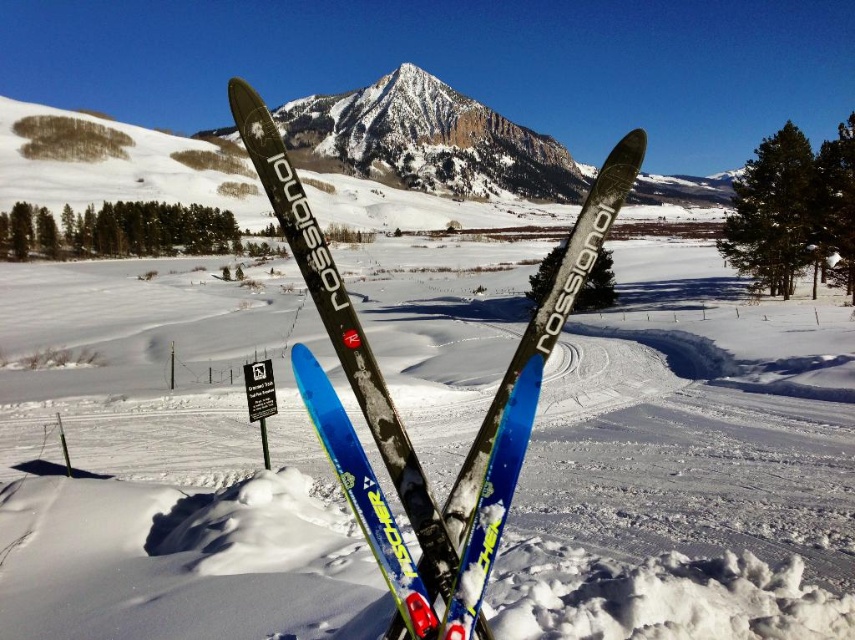
Consider the image. Measure the distance between blue glossy fischer skis at center and snowy granite peak at center.

They are 944.40 feet apart.

The width and height of the screenshot is (855, 640). In order to click on blue glossy fischer skis at center in this screenshot , I will do [x=343, y=330].